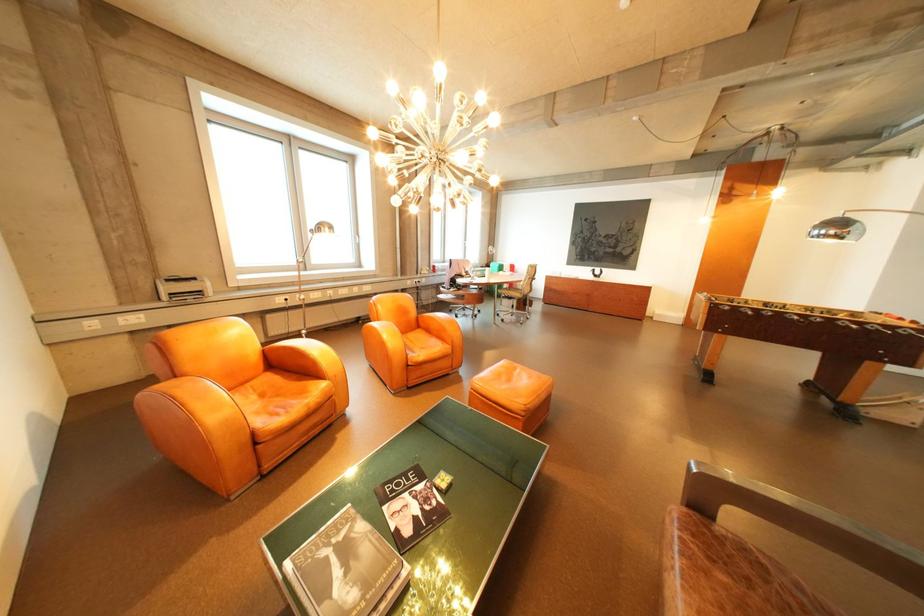
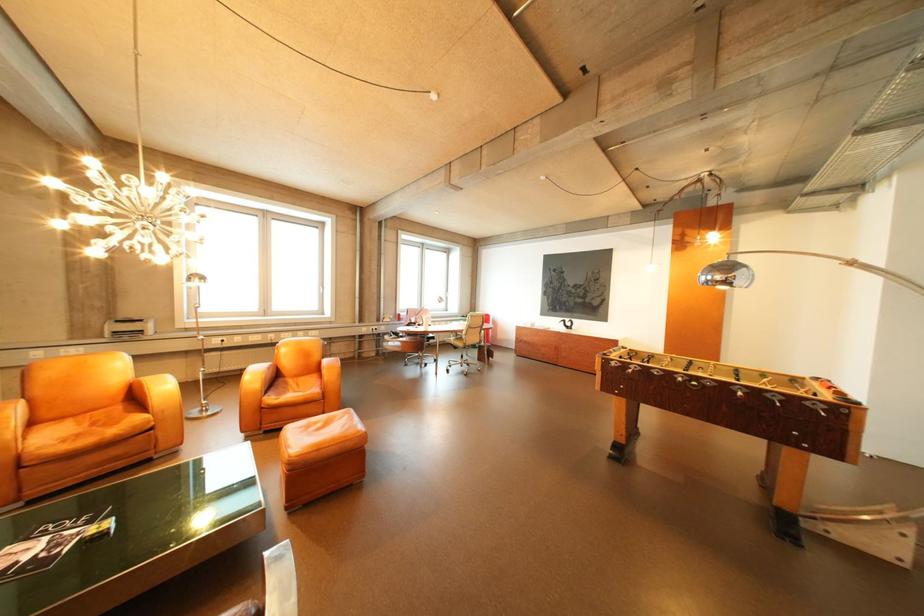
In the second image, find the point that corresponds to the point at 846,233 in the first image.

(732, 278)